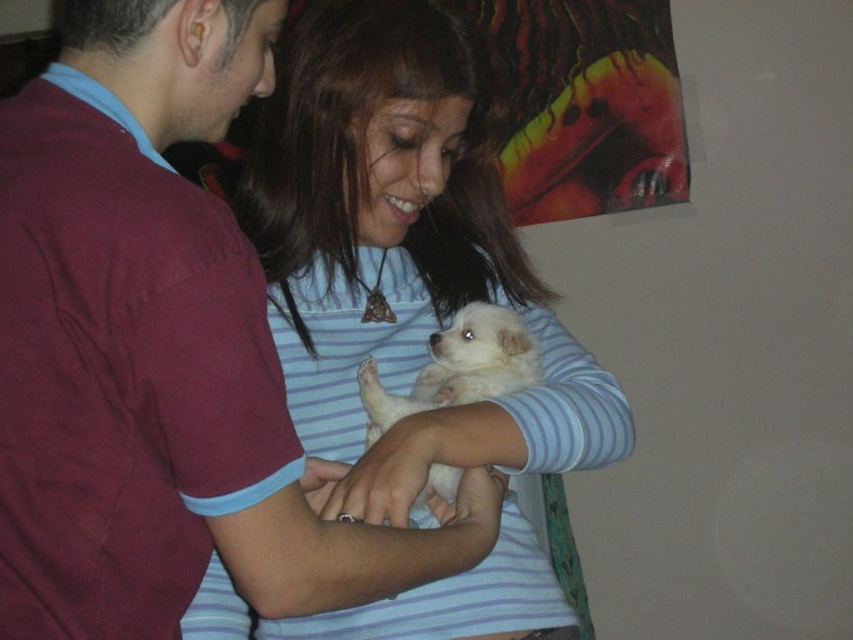
Question: Does white soft fur at center have a greater width compared to white fluffy dog at center?

Choices:
 (A) no
 (B) yes

Answer: (B)

Question: Is white soft fur at center to the left of white fluffy dog at center from the viewer's perspective?

Choices:
 (A) yes
 (B) no

Answer: (A)

Question: Which of the following is the closest to the observer?

Choices:
 (A) white soft fur at center
 (B) white fluffy dog at center

Answer: (A)

Question: Does white soft fur at center have a lesser width compared to white fluffy dog at center?

Choices:
 (A) yes
 (B) no

Answer: (B)